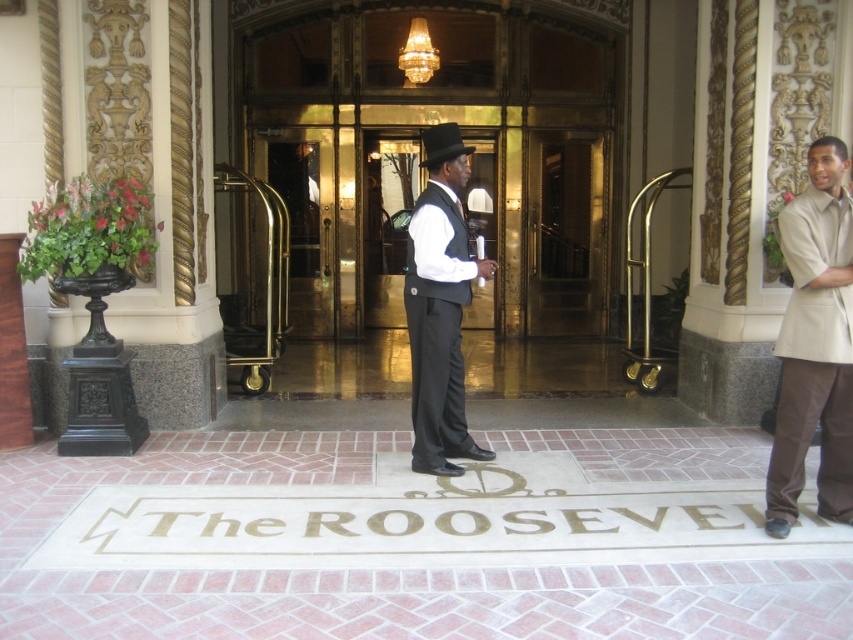
You are standing at the entrance of the grand hotel and need to locate a specific point marked as point (424, 182). Where exactly is this point located?

The point (424, 182) is located on the shiny gold door at center.

You are standing at the entrance of The ROOSEVELT hotel. You want to take a photo of the entrance while standing at point [434,45]. Will you be able to capture the entire entrance in your photo if your camera has a standard 50mm lens?

The distance between you and the entrance is 10.15 meters. With a standard 50mm lens, you can easily capture the entire entrance in your photo since the distance is sufficient for the lens to capture the full view without cropping.

You are a guest arriving at the entrance of The ROOSEVELT. You see the shiny gold door at center and the matte black suit at center. Which object is located to the right of the other?

The shiny gold door at center is positioned on the right side of the matte black suit at center.